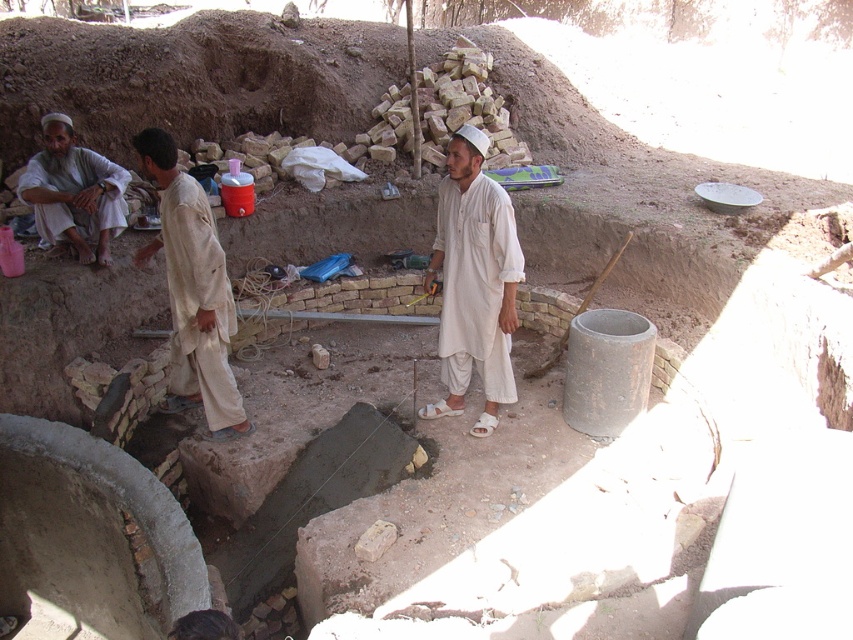
At what (x,y) coordinates should I click in order to perform the action: click on white cotton kameez at center. Please return your answer as a coordinate pair (x, y). Looking at the image, I should click on (474, 282).

Is white cotton kameez at center to the left of white cotton shirt at left from the viewer's perspective?

In fact, white cotton kameez at center is to the right of white cotton shirt at left.

Can you confirm if white cotton kameez at center is shorter than white cotton shirt at left?

No, white cotton kameez at center is not shorter than white cotton shirt at left.

Is point (456, 394) positioned behind point (61, 125)?

No, (456, 394) is closer to viewer.

Find the location of `white cotton kameez at center`. white cotton kameez at center is located at coordinates (474, 282).

Does point (167, 401) come closer to viewer compared to point (33, 204)?

Yes, it is in front of point (33, 204).

Does light beige cotton shirt at center have a lesser width compared to white cotton shirt at left?

Yes, light beige cotton shirt at center is thinner than white cotton shirt at left.

Measure the distance between point (245, 417) and camera.

Point (245, 417) and camera are 5.02 meters apart from each other.

Find the location of a particular element. This screenshot has width=853, height=640. light beige cotton shirt at center is located at coordinates [192, 291].